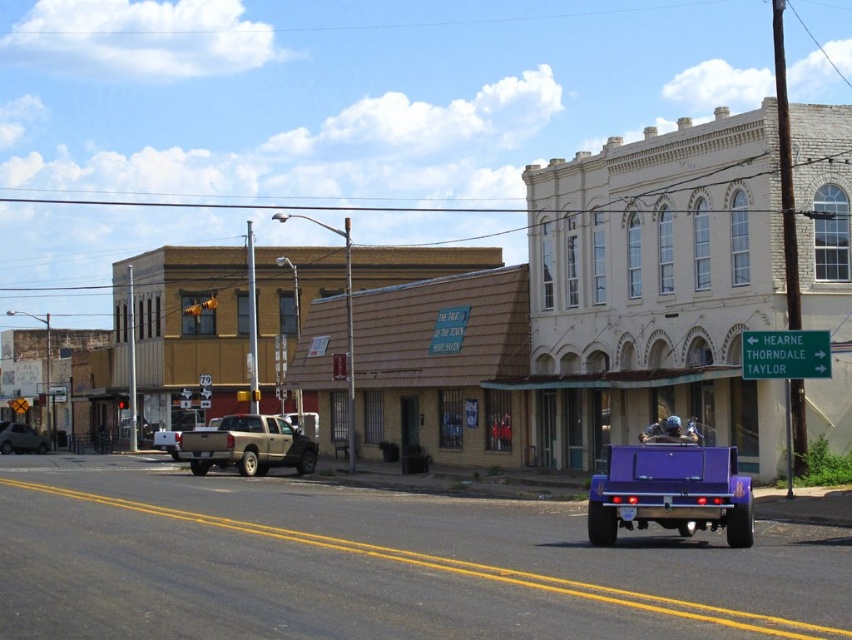
Which is more to the left, purple glossy truck at center or gold metallic truck at center?

gold metallic truck at center

Can you confirm if purple glossy truck at center is positioned below gold metallic truck at center?

No.

What do you see at coordinates (671, 488) in the screenshot? This screenshot has width=852, height=640. I see `purple glossy truck at center` at bounding box center [671, 488].

Locate an element on the screen. Image resolution: width=852 pixels, height=640 pixels. purple glossy truck at center is located at coordinates (671, 488).

In the scene shown: Between purple plastic utility vehicle at center and gold metallic truck at center, which one appears on the left side from the viewer's perspective?

Positioned to the left is gold metallic truck at center.

Does purple plastic utility vehicle at center appear over gold metallic truck at center?

Yes, purple plastic utility vehicle at center is above gold metallic truck at center.

Which is in front, point (758, 300) or point (213, 449)?

Point (758, 300)

Find the location of a particular element. This screenshot has width=852, height=640. purple plastic utility vehicle at center is located at coordinates (653, 285).

Is point (842, 362) in front of point (612, 477)?

No.

Which is more to the left, purple plastic utility vehicle at center or purple glossy truck at center?

From the viewer's perspective, purple plastic utility vehicle at center appears more on the left side.

Does point (751, 253) lie in front of point (643, 513)?

No, it is behind (643, 513).

Identify the location of purple plastic utility vehicle at center. (653, 285).